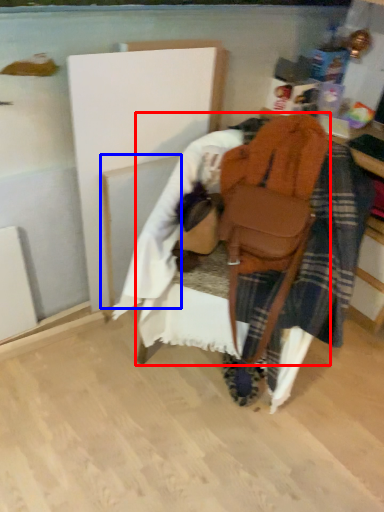
Question: Which object is closer to the camera taking this photo, furniture (highlighted by a red box) or wood (highlighted by a blue box)?

Choices:
 (A) furniture
 (B) wood

Answer: (A)